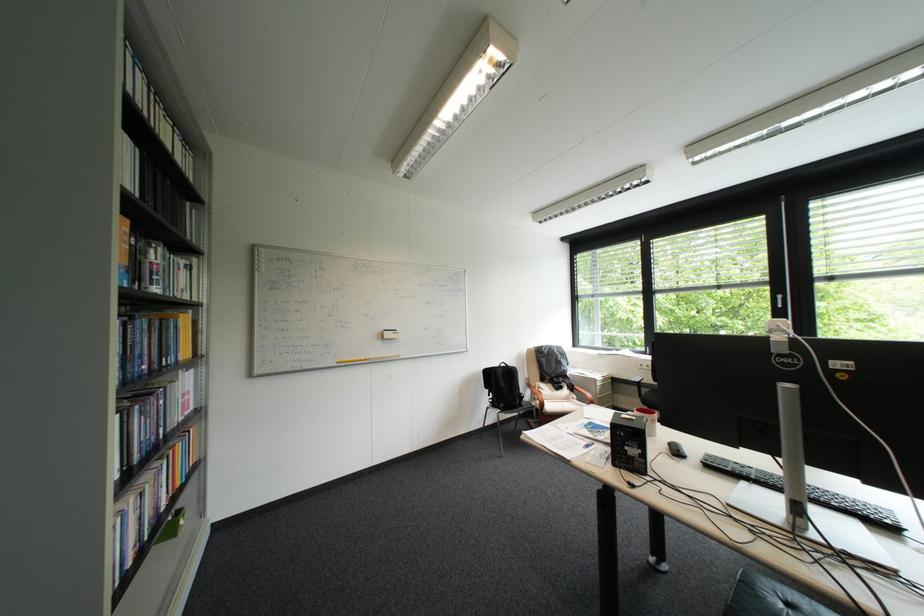
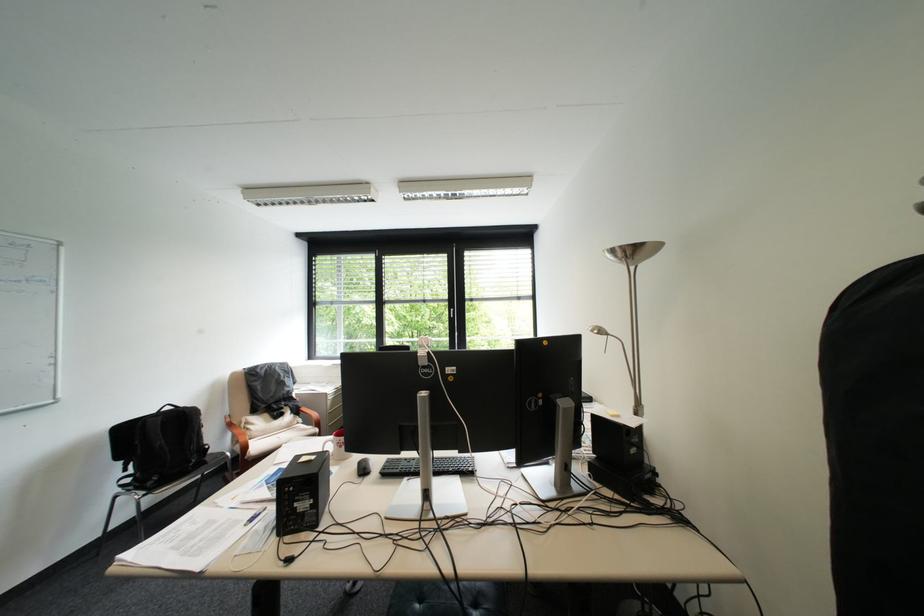
Question: How did the camera likely rotate?

Choices:
 (A) Left
 (B) Right
 (C) Up
 (D) Down

Answer: (B)